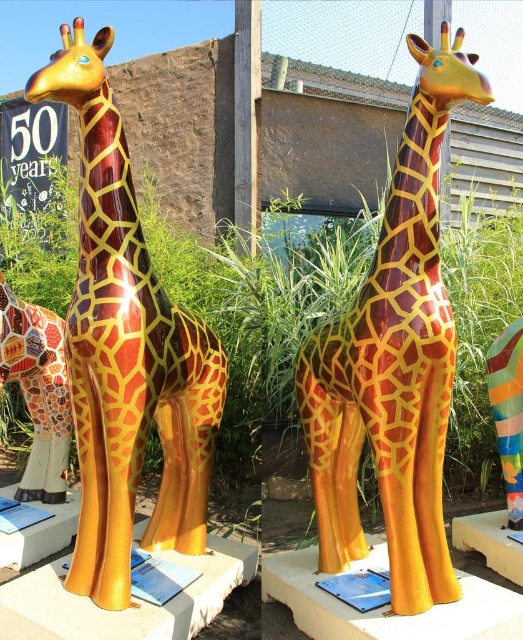
You are standing in front of the two large giraffe sculptures and notice two points on their platforms. The first point is at coordinate (x=188, y=515) and the second is at (x=168, y=570). Which point is closer to you?

Point (x=188, y=515) is closer to you because it is further to the viewer than point (x=168, y=570).

You are a visitor at the exhibit and see the glossy blue plaque at lower left and the metallic blue plaque at center. According to the description, which plaque is placed above the other?

The glossy blue plaque at lower left is positioned over the metallic blue plaque at center, meaning it is placed above the metallic blue plaque at center.